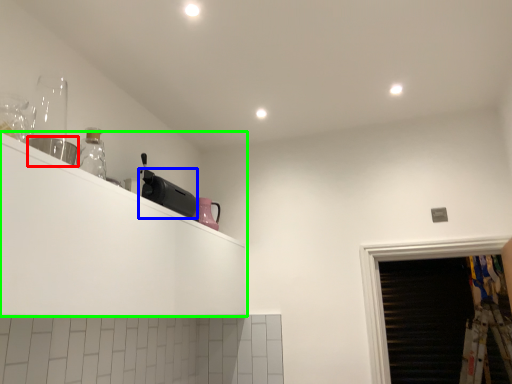
Question: Which is farther away from appliance (highlighted by a red box)? appliance (highlighted by a blue box) or shelf (highlighted by a green box)?

Choices:
 (A) appliance
 (B) shelf

Answer: (A)